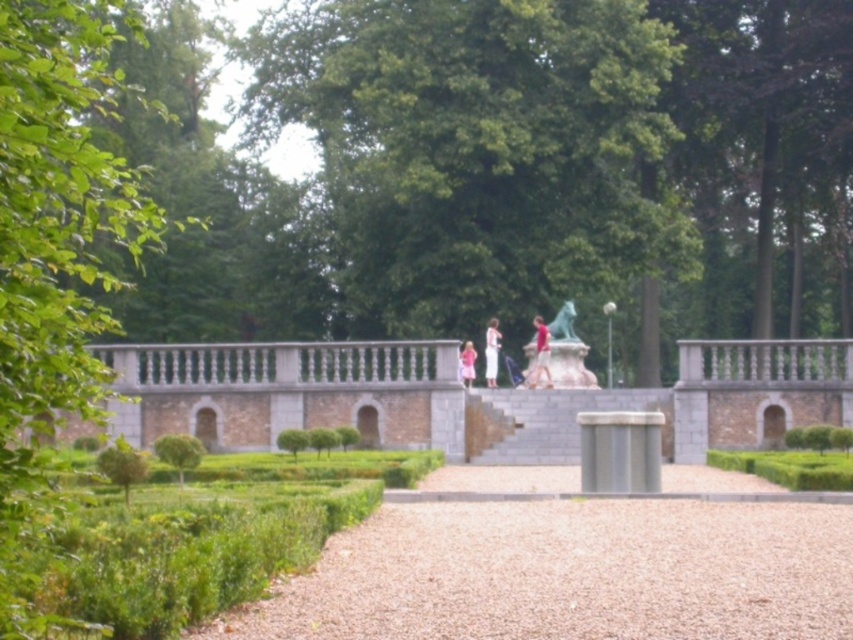
Question: Is green marble statue at center smaller than green leafy hedge at lower right?

Choices:
 (A) no
 (B) yes

Answer: (A)

Question: Does green leafy tree at left appear under green marble statue at center?

Choices:
 (A) no
 (B) yes

Answer: (A)

Question: Which point is farther to the camera?

Choices:
 (A) green marble statue at center
 (B) green leafy hedge at lower left
 (C) green leafy tree at left

Answer: (A)

Question: Does green leafy tree at left have a lesser width compared to green leafy hedge at lower right?

Choices:
 (A) yes
 (B) no

Answer: (B)

Question: Estimate the real-world distances between objects in this image. Which object is farther from the green marble statue at center?

Choices:
 (A) green leafy hedge at lower right
 (B) green leafy hedge at center
 (C) green leafy hedge at lower left

Answer: (C)

Question: Estimate the real-world distances between objects in this image. Which object is farther from the green leafy tree at left?

Choices:
 (A) green leafy hedge at center
 (B) green leafy hedge at lower left
 (C) green leafy hedge at lower right
 (D) green marble statue at center

Answer: (C)